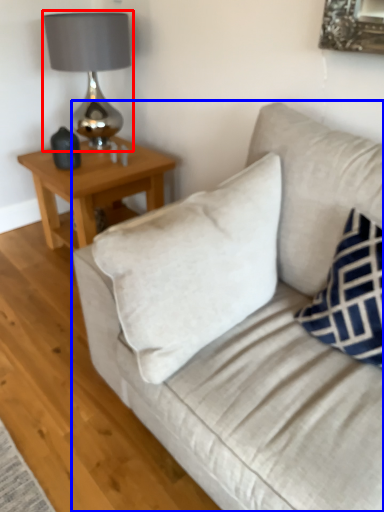
Question: Among these objects, which one is farthest to the camera, table lamp (highlighted by a red box) or studio couch (highlighted by a blue box)?

Choices:
 (A) table lamp
 (B) studio couch

Answer: (A)